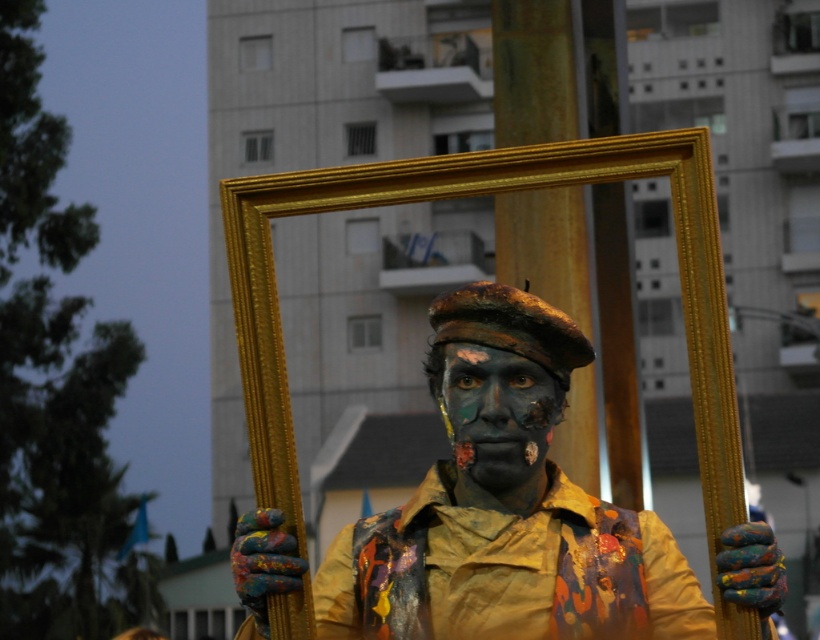
Question: Is painted fabric street artist at center bigger than painted skin face at center?

Choices:
 (A) no
 (B) yes

Answer: (B)

Question: Which point appears closest to the camera in this image?

Choices:
 (A) (527, 378)
 (B) (574, 522)

Answer: (A)

Question: From the image, what is the correct spatial relationship of painted fabric street artist at center in relation to painted skin face at center?

Choices:
 (A) left
 (B) right

Answer: (A)

Question: Can you confirm if painted fabric street artist at center is thinner than painted skin face at center?

Choices:
 (A) yes
 (B) no

Answer: (B)

Question: Which object is closer to the camera taking this photo?

Choices:
 (A) painted skin face at center
 (B) painted fabric street artist at center

Answer: (B)